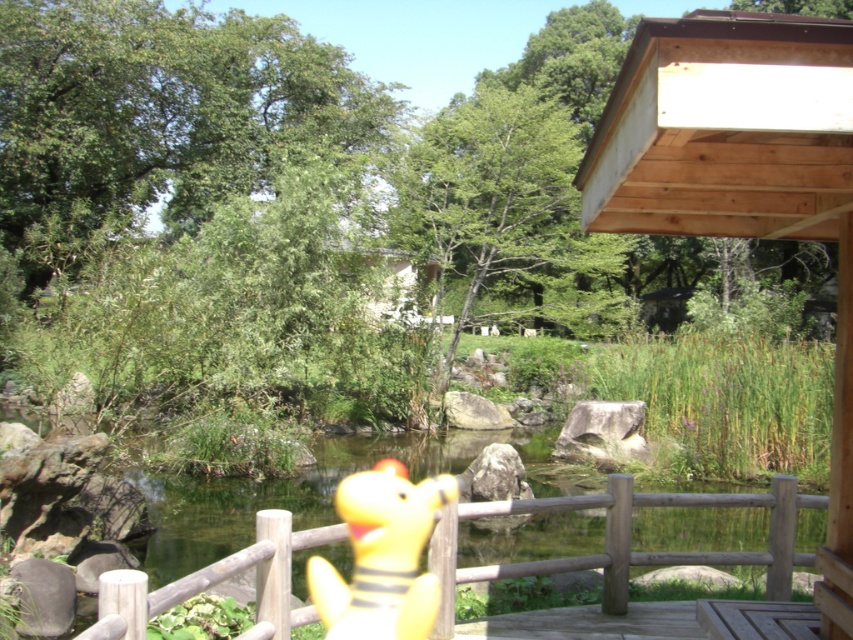
Identify the location of wooden at center. This screenshot has width=853, height=640. (624, 540).

At what (x,y) coordinates should I click in order to perform the action: click on wooden at center. Please return your answer as a coordinate pair (x, y). Looking at the image, I should click on (624, 540).